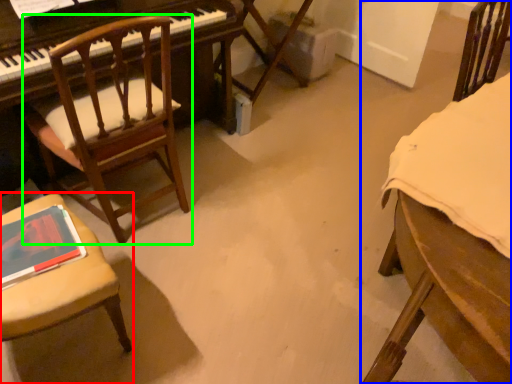
Question: Based on their relative distances, which object is nearer to chair (highlighted by a red box)? Choose from chair (highlighted by a blue box) and chair (highlighted by a green box).

Choices:
 (A) chair
 (B) chair

Answer: (B)